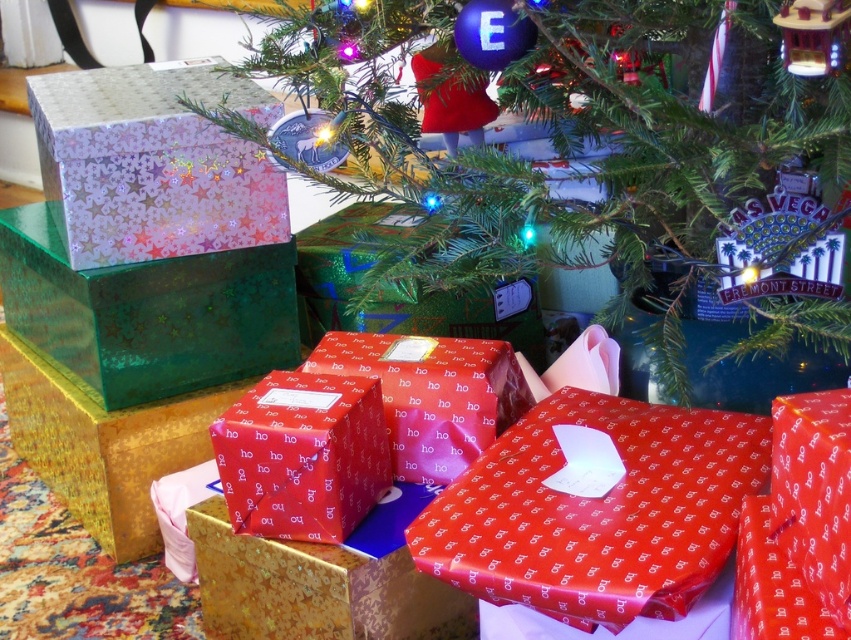
Question: Is holographic metallic gift box at upper left above shiny green wrapping paper at center?

Choices:
 (A) no
 (B) yes

Answer: (B)

Question: Which object is farther from the camera taking this photo?

Choices:
 (A) shiny green wrapping paper at center
 (B) shiny red wrapping paper at lower center
 (C) metallic green box at center

Answer: (A)

Question: Is holographic metallic gift box at upper left thinner than shiny green wrapping paper at center?

Choices:
 (A) no
 (B) yes

Answer: (B)

Question: Does shiny red wrapping paper at center have a smaller size compared to red shiny paper gift at center?

Choices:
 (A) no
 (B) yes

Answer: (B)

Question: Which point is closer to the camera?

Choices:
 (A) (832, 442)
 (B) (204, 364)

Answer: (A)

Question: Which point is farther to the camera?

Choices:
 (A) shiny red wrapping paper at lower center
 (B) shiny red wrapping paper at center

Answer: (B)